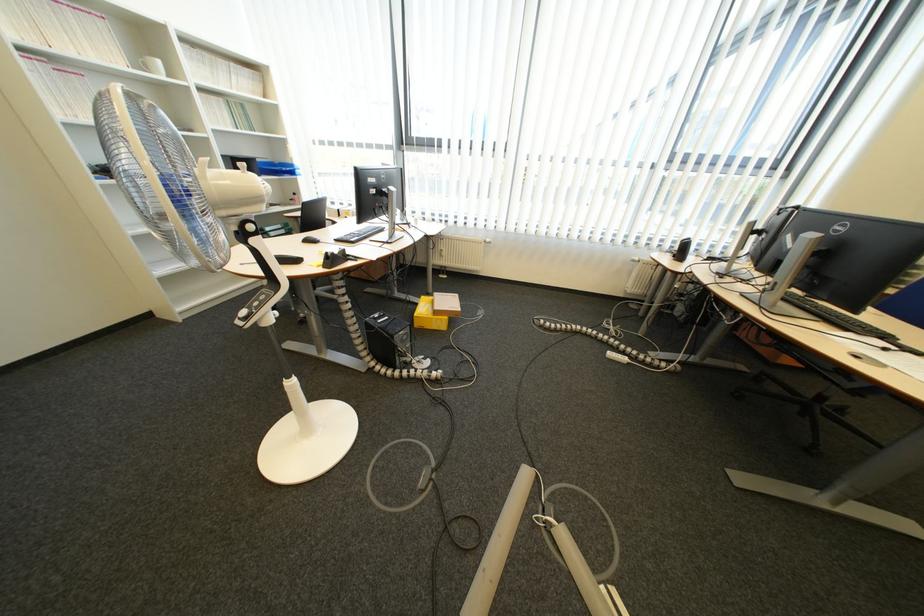
This screenshot has height=616, width=924. What do you see at coordinates (159, 177) in the screenshot?
I see `the fan adjustment handle` at bounding box center [159, 177].